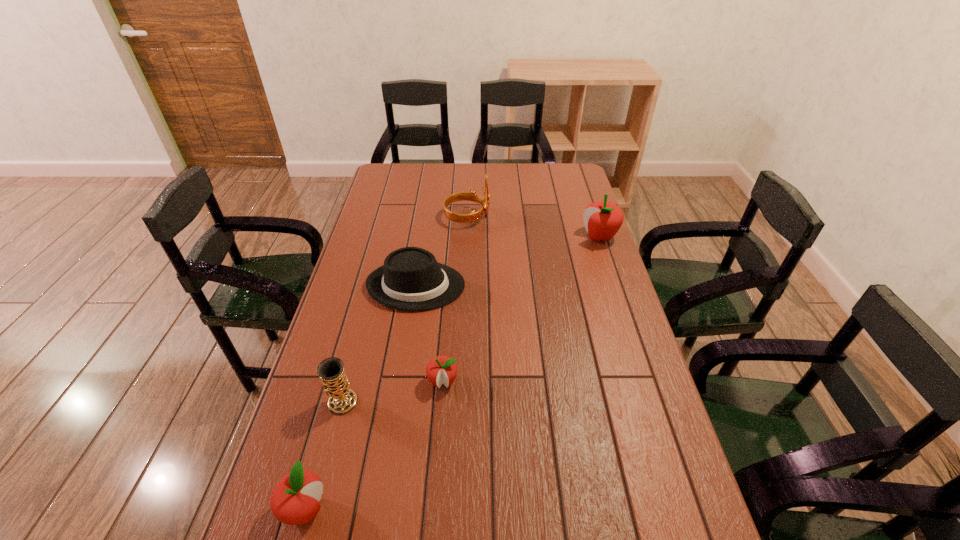
Where is `the leftmost apple`? Image resolution: width=960 pixels, height=540 pixels. the leftmost apple is located at coordinates (294, 500).

The height and width of the screenshot is (540, 960). I want to click on the nearest object, so click(x=294, y=500).

This screenshot has width=960, height=540. Find the location of `the second nearest apple`. the second nearest apple is located at coordinates (440, 370).

What are the coordinates of `the second apple from left to right` in the screenshot? It's located at (440, 370).

You are a GUI agent. You are given a task and a screenshot of the screen. Output one action in this format:
    pyautogui.click(x=<x>, y=<y>)
    Task: Click on the farthest apple
    
    Given the screenshot: What is the action you would take?
    [x=602, y=219]

The width and height of the screenshot is (960, 540). I want to click on the tallest apple, so click(x=602, y=219).

Where is `fedora`? The height and width of the screenshot is (540, 960). fedora is located at coordinates (411, 279).

The image size is (960, 540). I want to click on tiara, so click(x=461, y=196).

You are a GUI agent. You are given a task and a screenshot of the screen. Output one action in this format:
    pyautogui.click(x=<x>, y=<y>)
    Task: Click on the chalice
    The width and height of the screenshot is (960, 540).
    Given the screenshot: What is the action you would take?
    pyautogui.click(x=342, y=400)

Locate an element on the screen. vacant area situated 0.190m on the back of the nearest object is located at coordinates (333, 409).